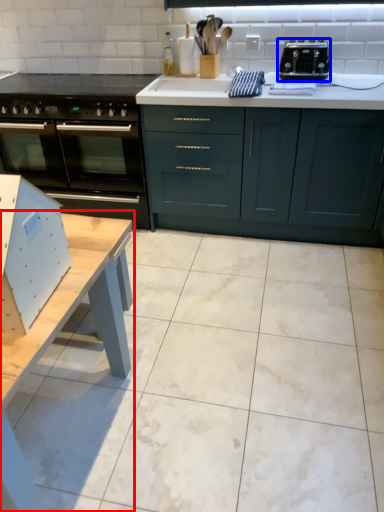
Question: Which object is further to the camera taking this photo, table (highlighted by a red box) or toaster (highlighted by a blue box)?

Choices:
 (A) table
 (B) toaster

Answer: (B)